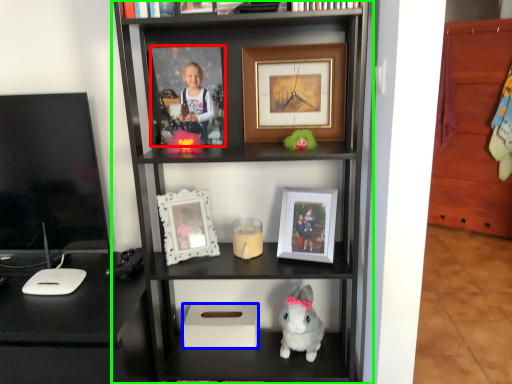
Question: Which object is the closest to the picture frame (highlighted by a red box)? Choose among these: box (highlighted by a blue box) or shelf (highlighted by a green box).

Choices:
 (A) box
 (B) shelf

Answer: (B)